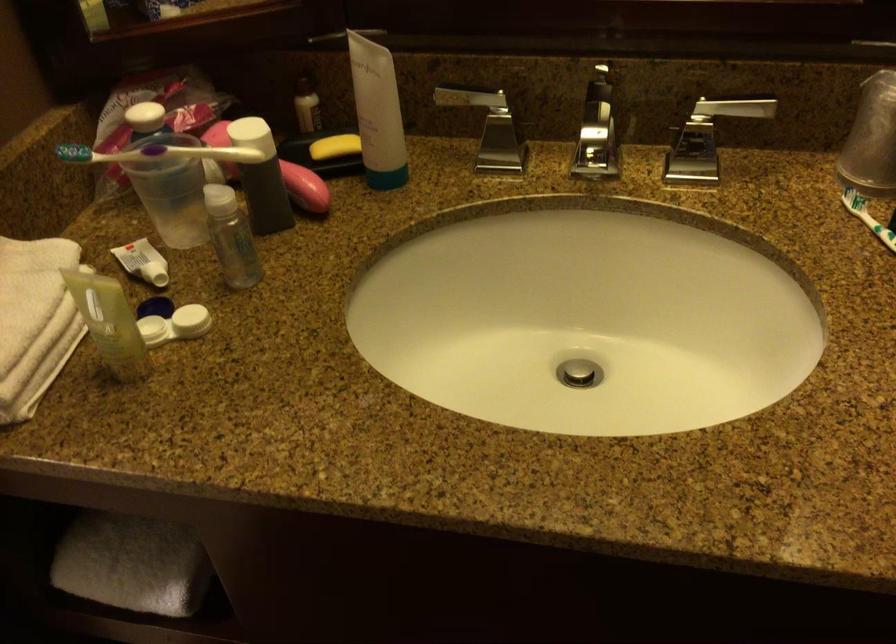
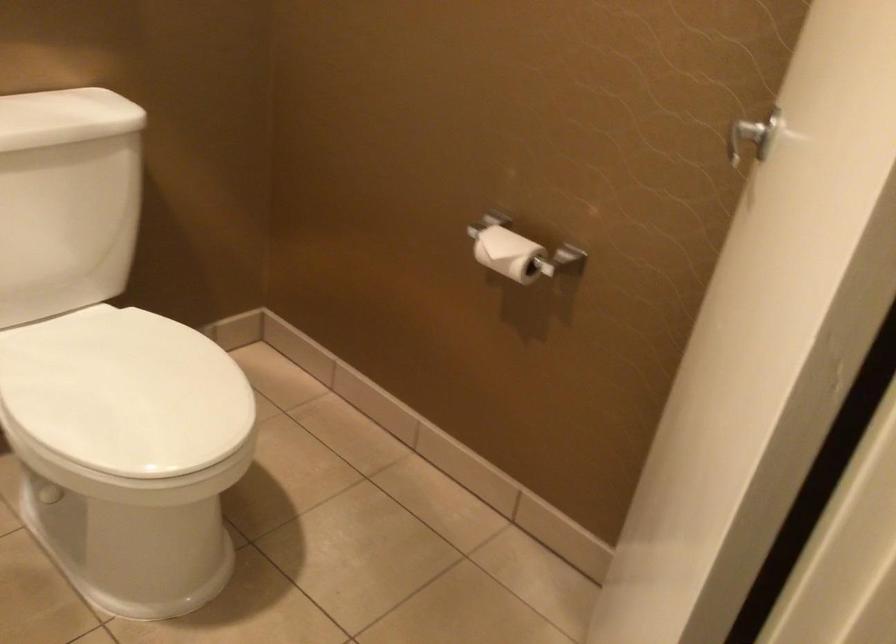
Question: The first image is from the beginning of the video and the second image is from the end. How did the camera likely rotate when shooting the video?

Choices:
 (A) Left
 (B) Right
 (C) Up
 (D) Down

Answer: (A)